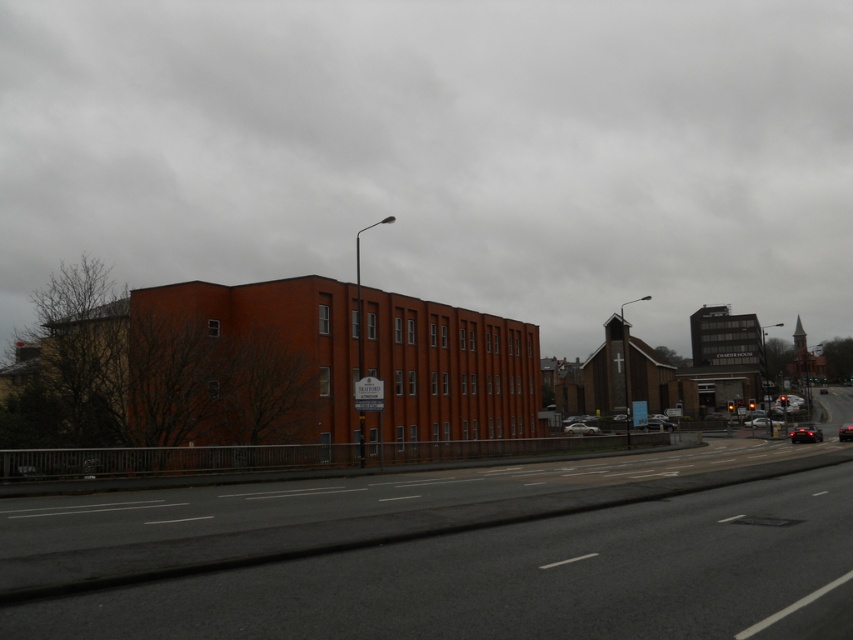
You are a delivery driver who needs to park your vehicle in a tight space between the silver metallic sedan at center and the black glossy car at center. Your vehicle is 4.5 meters long. Can you fit your vehicle between them if the space between the two cars is 5 meters long?

The space between the silver metallic sedan at center and the black glossy car at center is 5 meters long. Since your vehicle is 4.5 meters long, it can fit in the space between them.

You are a delivery drone flying above an urban area and need to navigate between two points marked as point (x=811, y=429) and point (x=764, y=420). According to the scene, which point is closer to the observer?

Point (x=811, y=429) is in front of point (x=764, y=420), so it is closer to the observer.

From the picture: You are a delivery driver needing to park your vehicle between the silver metallic sedan at center and the black glossy car at center. Based on their positions, which side should you park on to ensure your car is between them?

The silver metallic sedan at center is located below the black glossy car at center. To park between them, you should position your car above the silver metallic sedan at center and below the black glossy car at center.